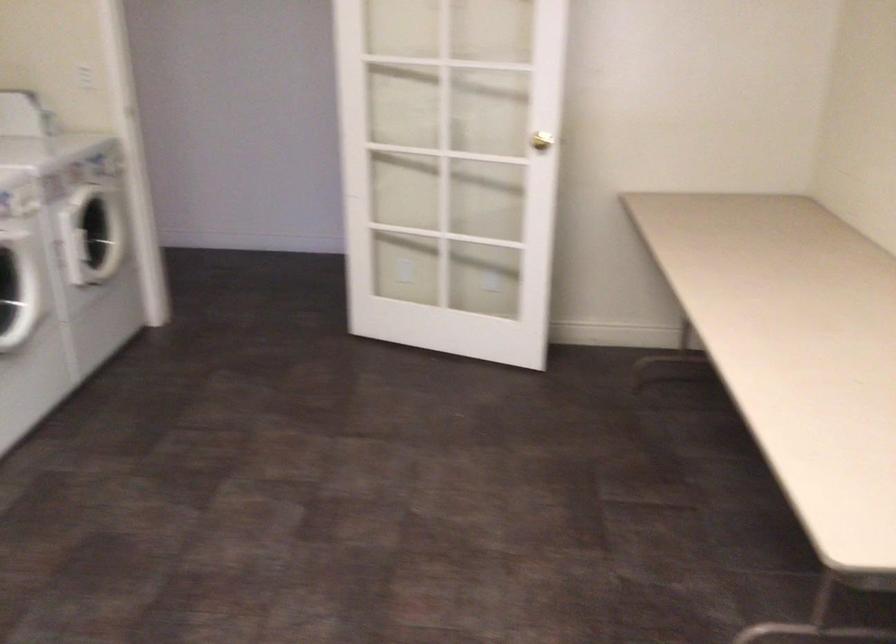
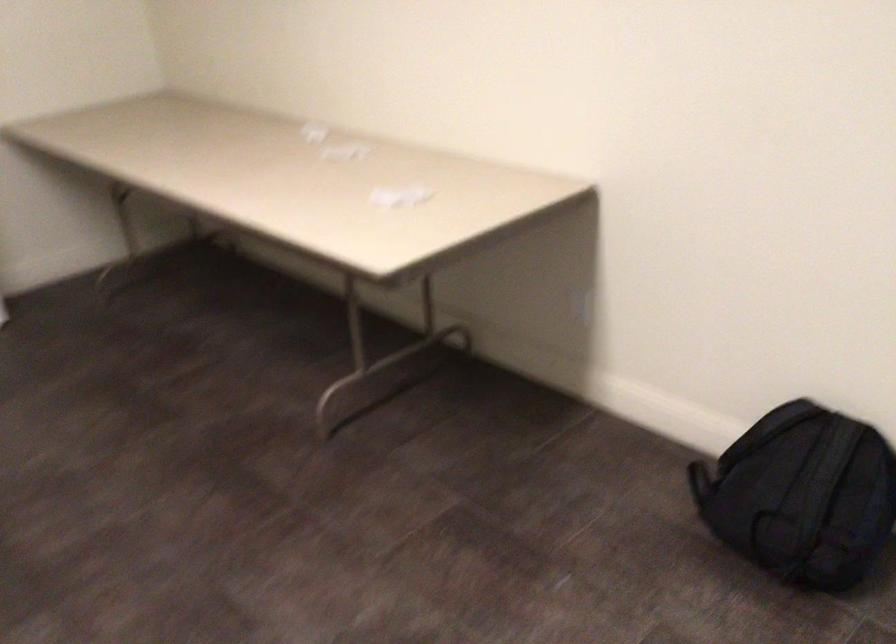
Question: Based on the continuous images, in which direction is the camera rotating? Reply with the corresponding letter.

Choices:
 (A) Left
 (B) Right
 (C) Up
 (D) Down

Answer: (B)